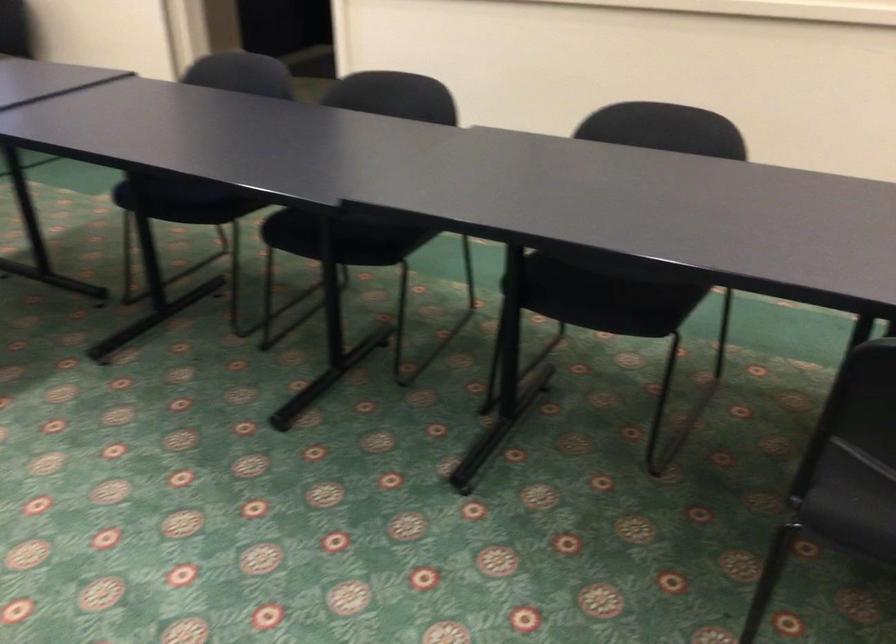
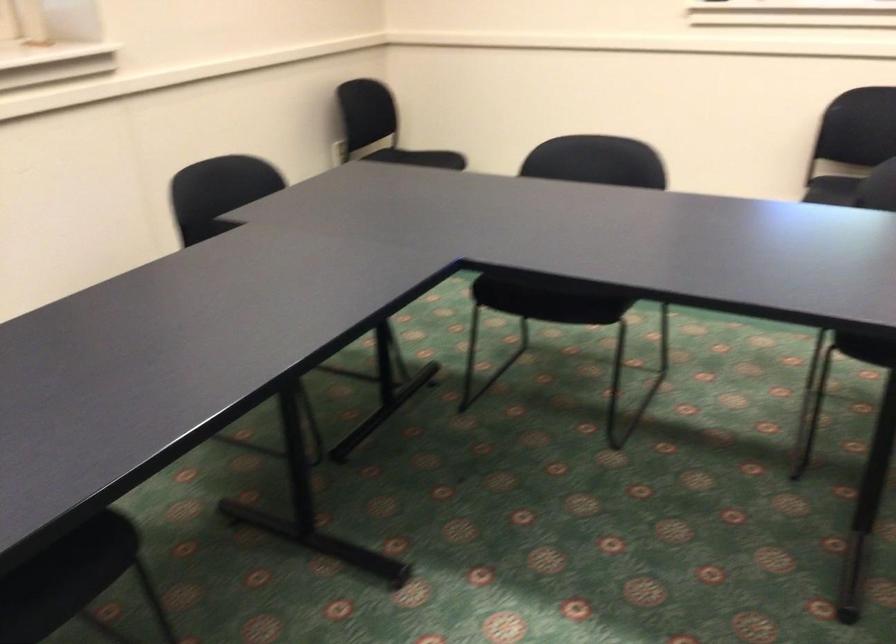
The first image is from the beginning of the video and the second image is from the end. How did the camera likely rotate when shooting the video?

The rotation direction of the camera is left-down.